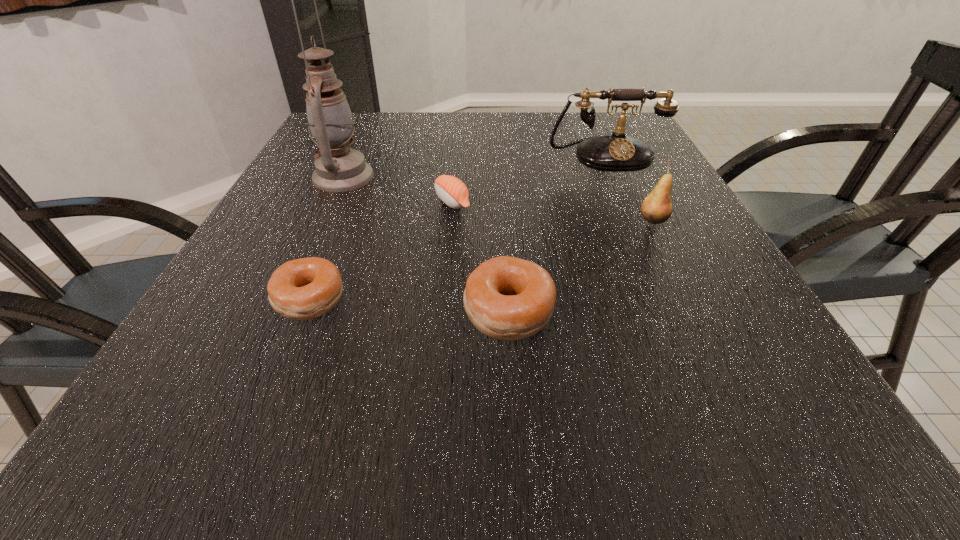
You are a GUI agent. You are given a task and a screenshot of the screen. Output one action in this format:
    pyautogui.click(x=<x>, y=<y>)
    Task: Click on the free space at the far edge of the desktop
    The width and height of the screenshot is (960, 540).
    Given the screenshot: What is the action you would take?
    pyautogui.click(x=517, y=145)

This screenshot has height=540, width=960. In the image, there is a desktop. What are the coordinates of `vacant space at the near edge` in the screenshot? It's located at (477, 343).

You are a GUI agent. You are given a task and a screenshot of the screen. Output one action in this format:
    pyautogui.click(x=<x>, y=<y>)
    Task: Click on the free space at the left edge
    
    Given the screenshot: What is the action you would take?
    pyautogui.click(x=308, y=216)

This screenshot has width=960, height=540. In the image, there is a desktop. In order to click on free space at the right edge in this screenshot , I will do `click(704, 323)`.

Where is `blank space at the near left corner of the desktop`? Image resolution: width=960 pixels, height=540 pixels. blank space at the near left corner of the desktop is located at coordinates (156, 378).

Where is `vacant area that lies between the tallest object and the telephone`? vacant area that lies between the tallest object and the telephone is located at coordinates (473, 166).

I want to click on unoccupied area between the tallest object and the right bagel, so click(426, 244).

Identify the location of free spot between the taller bagel and the sushi. The width and height of the screenshot is (960, 540). (480, 256).

I want to click on free spot between the sushi and the pear, so click(553, 211).

This screenshot has height=540, width=960. I want to click on vacant area that lies between the sushi and the second tallest object, so click(528, 179).